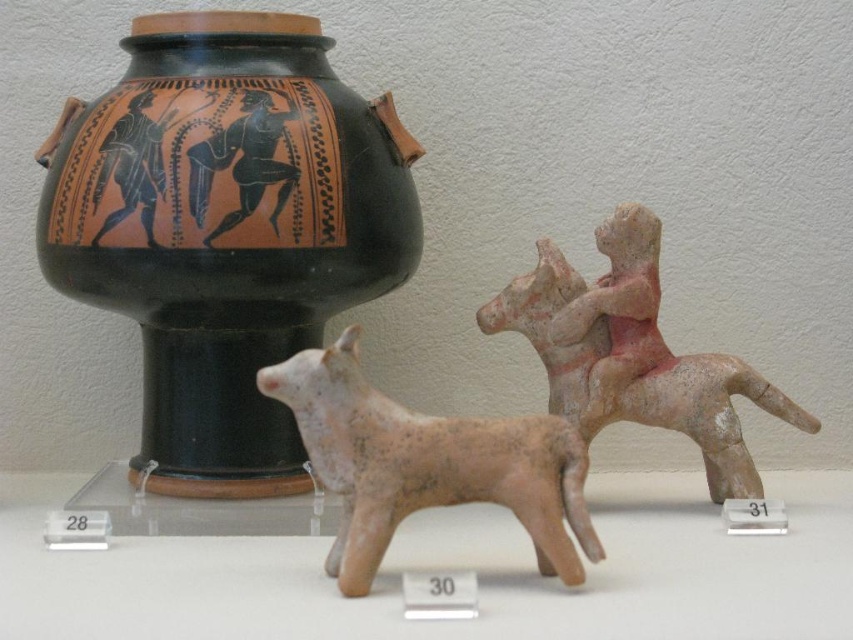
Question: Which point appears farthest from the camera in this image?

Choices:
 (A) click(282, 298)
 (B) click(318, 420)

Answer: (A)

Question: Where is matte clay dog at center located in relation to matte pink clay horse rider at right in the image?

Choices:
 (A) left
 (B) right

Answer: (A)

Question: Is black matte vase at upper left below matte pink clay horse rider at right?

Choices:
 (A) yes
 (B) no

Answer: (B)

Question: Which object is farther from the camera taking this photo?

Choices:
 (A) black matte vase at upper left
 (B) matte pink clay horse rider at right
 (C) matte clay dog at center

Answer: (B)

Question: Where is matte clay dog at center located in relation to matte pink clay horse rider at right in the image?

Choices:
 (A) right
 (B) left

Answer: (B)

Question: Considering the real-world distances, which object is farthest from the black matte vase at upper left?

Choices:
 (A) matte clay dog at center
 (B) matte pink clay horse rider at right

Answer: (B)